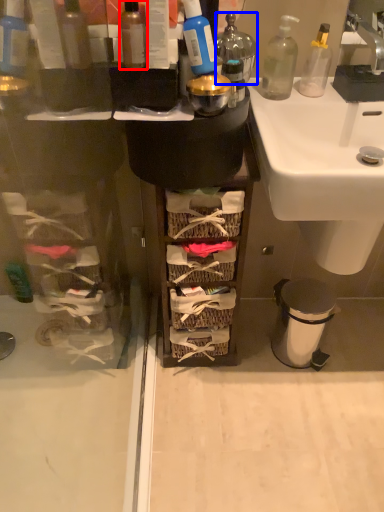
Question: Which object is further to the camera taking this photo, bottle (highlighted by a red box) or bottle (highlighted by a blue box)?

Choices:
 (A) bottle
 (B) bottle

Answer: (B)